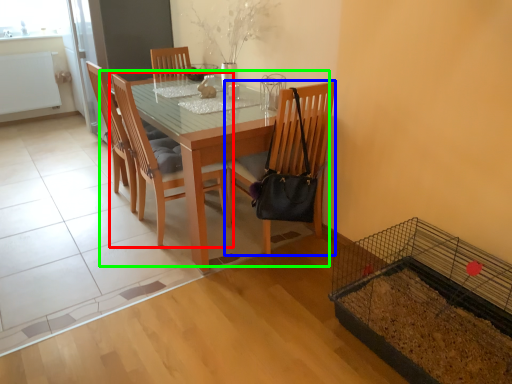
Question: Estimate the real-world distances between objects in this image. Which object is farther from chair (highlighted by a red box), chair (highlighted by a blue box) or kitchen & dining room table (highlighted by a green box)?

Choices:
 (A) chair
 (B) kitchen & dining room table

Answer: (A)